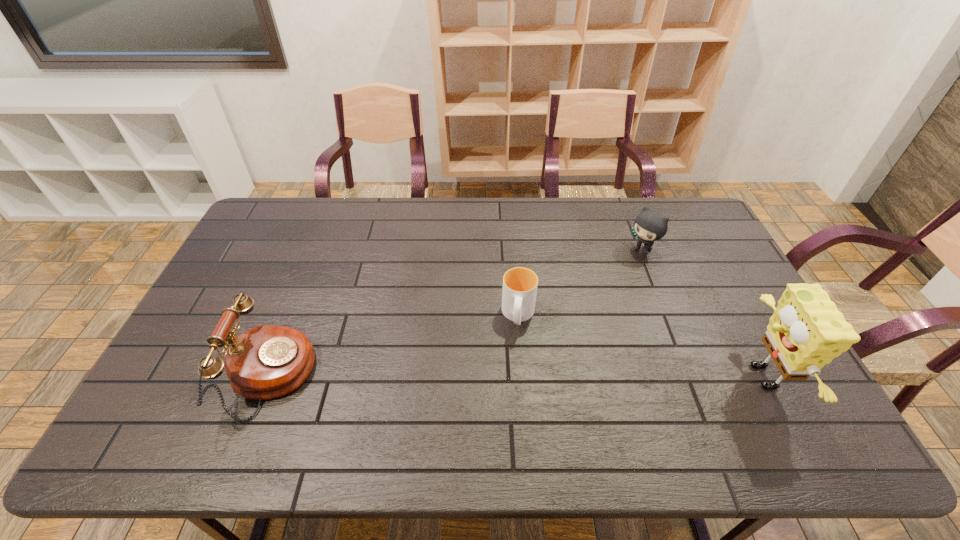
Identify the location of the third shortest object. Image resolution: width=960 pixels, height=540 pixels. (265, 362).

The width and height of the screenshot is (960, 540). What are the coordinates of `the leftmost object` in the screenshot? It's located at (265, 362).

Identify the location of the tallest object. This screenshot has width=960, height=540. (806, 331).

Locate an element on the screen. This screenshot has height=540, width=960. sponge is located at coordinates (806, 331).

Where is `the shortest object`? This screenshot has width=960, height=540. the shortest object is located at coordinates (520, 284).

Locate an element on the screen. Image resolution: width=960 pixels, height=540 pixels. cup is located at coordinates (520, 284).

Where is `the farthest object`? the farthest object is located at coordinates (649, 226).

Locate an element on the screen. The width and height of the screenshot is (960, 540). the third object from left to right is located at coordinates (649, 226).

Find the location of a particular element. This screenshot has width=960, height=540. vacant space situated 0.400m on the dial of the third shortest object is located at coordinates (464, 376).

At what (x,y) coordinates should I click in order to perform the action: click on free region located 0.050m on the front-facing side of the rightmost object. Please return your answer as a coordinate pair (x, y). This screenshot has height=540, width=960. Looking at the image, I should click on (718, 376).